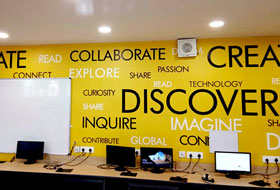
I want to click on white board, so click(56, 111).